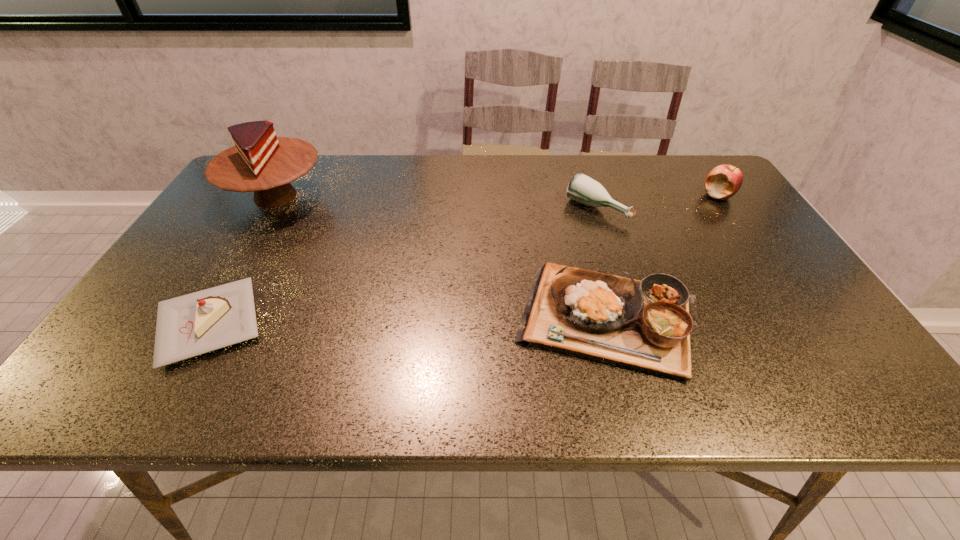
The image size is (960, 540). In order to click on the tallest object in this screenshot , I will do `click(260, 161)`.

At what (x,y) coordinates should I click in order to perform the action: click on the taller cake. Please return your answer as a coordinate pair (x, y). Looking at the image, I should click on (260, 161).

Where is `apple`? Image resolution: width=960 pixels, height=540 pixels. apple is located at coordinates (724, 181).

You are a GUI agent. You are given a task and a screenshot of the screen. Output one action in this format:
    pyautogui.click(x=<x>, y=<y>)
    Task: Click on the second tallest object
    The width and height of the screenshot is (960, 540).
    Given the screenshot: What is the action you would take?
    pyautogui.click(x=724, y=181)

In order to click on bottle in this screenshot , I will do pyautogui.click(x=582, y=188).

You are a GUI agent. You are given a task and a screenshot of the screen. Output one action in this format:
    pyautogui.click(x=<x>, y=<y>)
    Task: Click on the platter
    Image resolution: width=960 pixels, height=540 pixels.
    Given the screenshot: What is the action you would take?
    pyautogui.click(x=646, y=325)

This screenshot has width=960, height=540. I want to click on the shorter cake, so click(190, 325).

Where is `the nearer cake`? the nearer cake is located at coordinates (190, 325).

At what (x,y) coordinates should I click in order to perform the action: click on vacant space located on the front of the taller cake. Please return your answer as a coordinate pair (x, y). Looking at the image, I should click on (218, 294).

What are the coordinates of `free space located on the left of the rightmost object` in the screenshot? It's located at (639, 195).